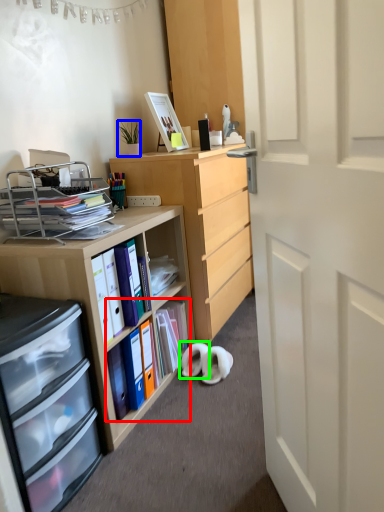
Question: Considering the real-world distances, which object is closest to book (highlighted by a red box)? houseplant (highlighted by a blue box) or footwear (highlighted by a green box).

Choices:
 (A) houseplant
 (B) footwear

Answer: (B)